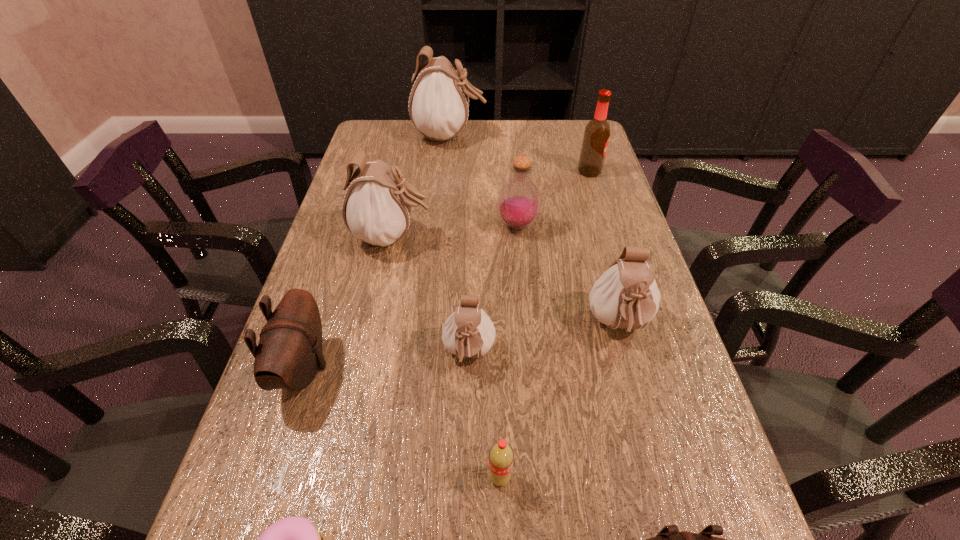
Where is `free space between the farthest object and the fifth shortest pouch`? Image resolution: width=960 pixels, height=540 pixels. free space between the farthest object and the fifth shortest pouch is located at coordinates (421, 186).

You are a GUI agent. You are given a task and a screenshot of the screen. Output one action in this format:
    pyautogui.click(x=<x>, y=<y>)
    Task: Click on the free space between the ninth nearest object and the smallest white pouch
    The width and height of the screenshot is (960, 540).
    Given the screenshot: What is the action you would take?
    pyautogui.click(x=529, y=263)

The width and height of the screenshot is (960, 540). I want to click on vacant space in between the tallest pouch and the second farthest object, so click(x=519, y=153).

Where is `empty location between the rightmost white pouch and the tallest pouch`? empty location between the rightmost white pouch and the tallest pouch is located at coordinates [x=534, y=231].

Locate an element on the screen. The height and width of the screenshot is (540, 960). vacant area that lies between the bigger brown pouch and the eighth farthest object is located at coordinates (401, 422).

Where is `free point between the third nearest white pouch and the farther brown pouch`? This screenshot has width=960, height=540. free point between the third nearest white pouch and the farther brown pouch is located at coordinates (348, 302).

Where is `vacant point located between the ninth nearest object and the tallest pouch`? vacant point located between the ninth nearest object and the tallest pouch is located at coordinates (519, 153).

The width and height of the screenshot is (960, 540). I want to click on object that is the fourth closest to the shortest object, so click(x=669, y=539).

Select which object appears as the seventh closest to the nearest pouch. Please provide its 2D coordinates. Your answer should be formatted as a tuple, i.e. [(x, y)], where the tuple contains the x and y coordinates of a point satisfying the conditions above.

[(377, 206)]

Identify which pouch is the fifth closest to the red soda. Please provide its 2D coordinates. Your answer should be formatted as a tuple, i.e. [(x, y)], where the tuple contains the x and y coordinates of a point satisfying the conditions above.

[(377, 206)]